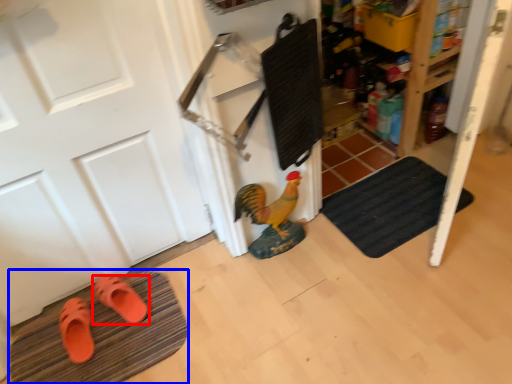
Question: Which object is closer to the camera taking this photo, footwear (highlighted by a red box) or bath mat (highlighted by a blue box)?

Choices:
 (A) footwear
 (B) bath mat

Answer: (B)